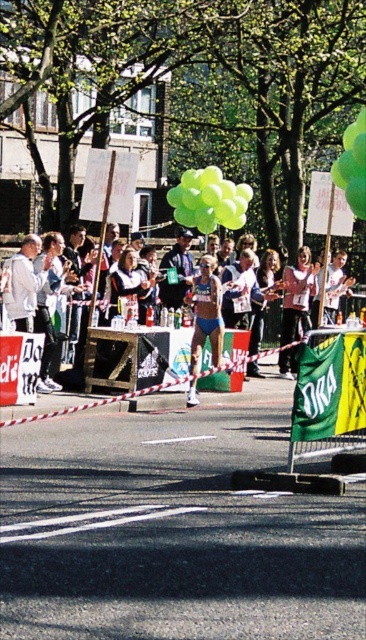
Does green rubber balloon at upper center come in front of white cotton jacket at center?

Yes, green rubber balloon at upper center is closer to the viewer.

Is green rubber balloon at upper center to the right of white cotton jacket at center from the viewer's perspective?

Yes, green rubber balloon at upper center is to the right of white cotton jacket at center.

You are a GUI agent. You are given a task and a screenshot of the screen. Output one action in this format:
    pyautogui.click(x=<x>, y=<y>)
    Task: Click on the green rubber balloon at upper center
    
    Given the screenshot: What is the action you would take?
    pyautogui.click(x=352, y=164)

Is white hoodie at left above matte blue shorts at center?

Correct, white hoodie at left is located above matte blue shorts at center.

Which is behind, point (43, 280) or point (200, 346)?

The point (43, 280) is more distant.

The image size is (366, 640). What are the coordinates of `white hoodie at left` in the screenshot? It's located at pyautogui.click(x=28, y=280).

Who is higher up, matte black shirt at center or white cotton jacket at center?

Positioned higher is matte black shirt at center.

Is point (173, 262) positioned behind point (329, 292)?

No, (173, 262) is in front of (329, 292).

Image resolution: width=366 pixels, height=640 pixels. I want to click on matte black shirt at center, so click(x=177, y=269).